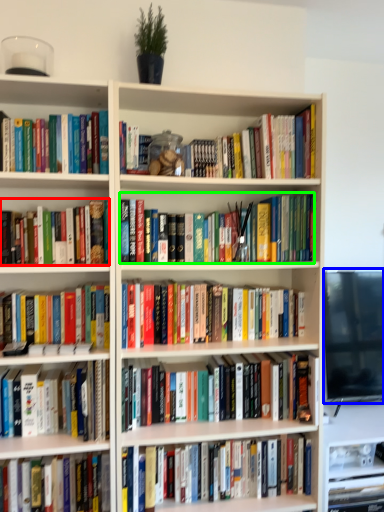
Question: Based on their relative distances, which object is nearer to book (highlighted by a red box)? Choose from computer monitor (highlighted by a blue box) and book (highlighted by a green box).

Choices:
 (A) computer monitor
 (B) book

Answer: (B)